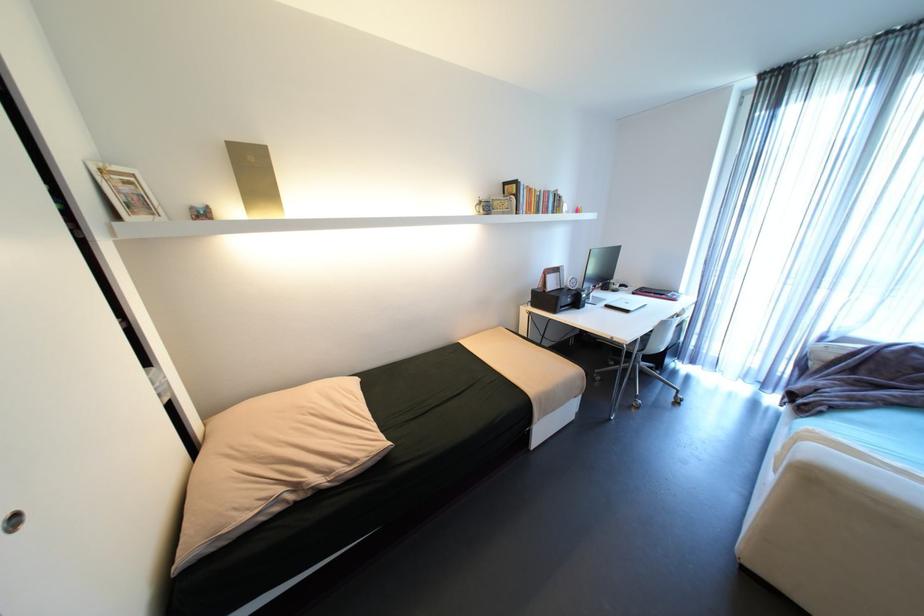
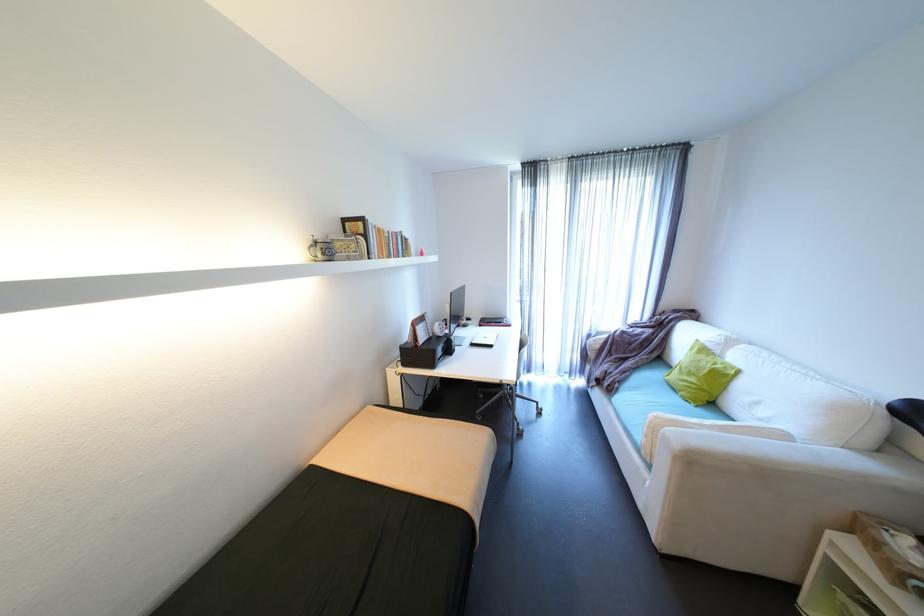
In the second image, find the point that corresponds to point (857, 403) in the first image.

(630, 377)